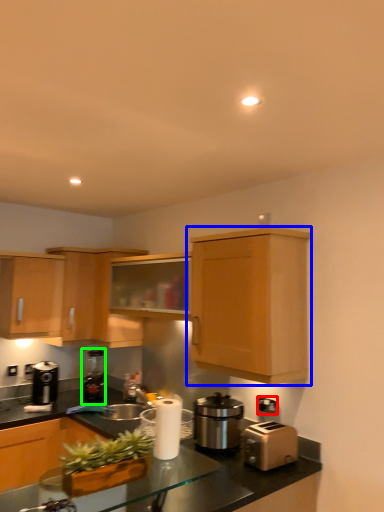
Question: Which is farther away from electric outlet (highlighted by a red box)? cabinetry (highlighted by a blue box) or coffee machine (highlighted by a green box)?

Choices:
 (A) cabinetry
 (B) coffee machine

Answer: (B)